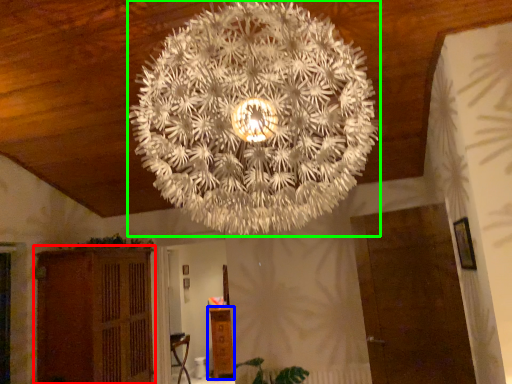
Question: Which object is the closest to the furniture (highlighted by a red box)? Choose among these: furniture (highlighted by a blue box) or lamp (highlighted by a green box).

Choices:
 (A) furniture
 (B) lamp

Answer: (A)